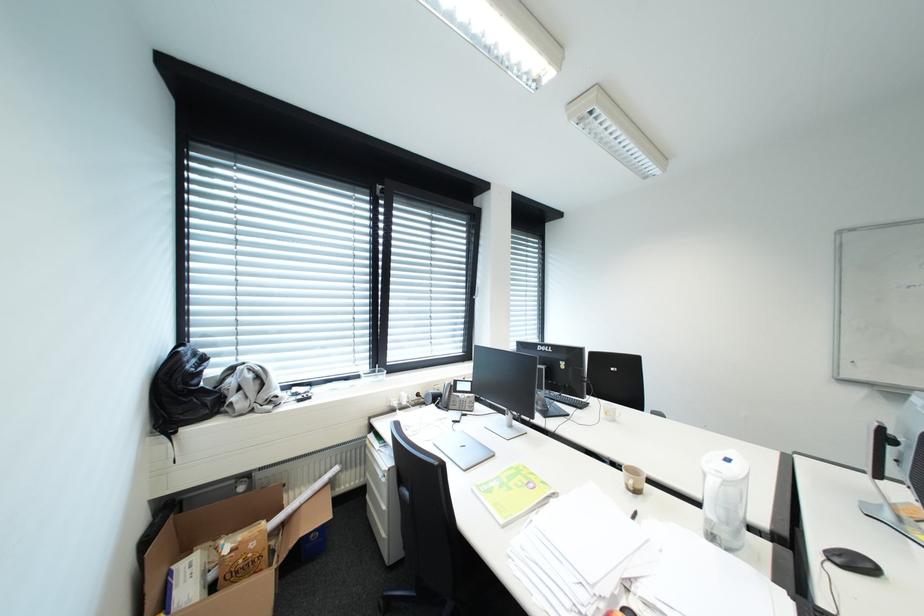
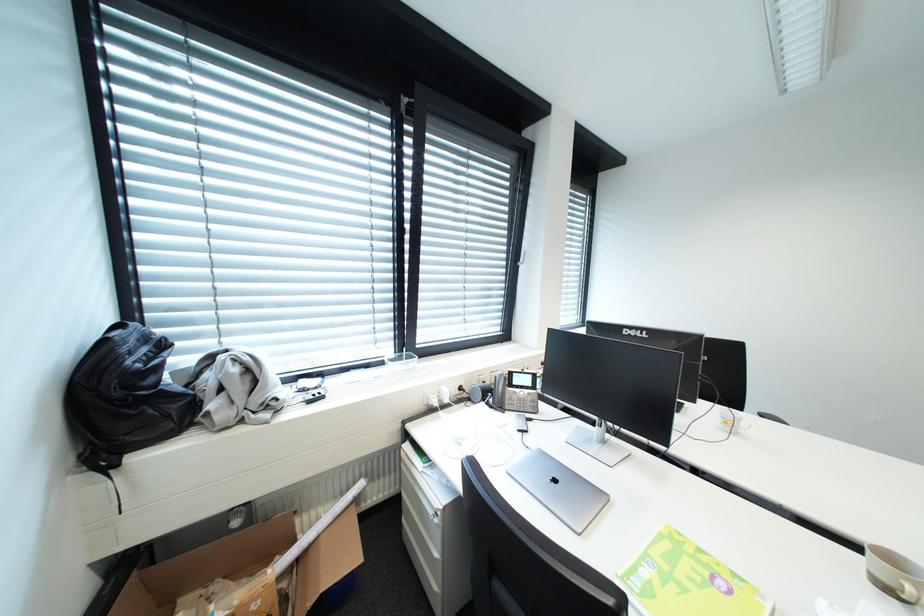
What movement of the cameraman would produce the second image?

The cameraman moved toward left, forward.